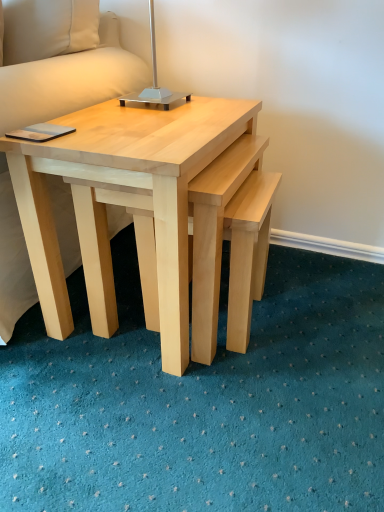
Question: Relative to white fabric pillow at upper left, is metallic silver table lamp at upper center in front or behind?

Choices:
 (A) front
 (B) behind

Answer: (A)

Question: Is metallic silver table lamp at upper center taller or shorter than white fabric pillow at upper left?

Choices:
 (A) tall
 (B) short

Answer: (A)

Question: Based on their relative distances, which object is farther from the natural wood coffee table at center?

Choices:
 (A) white fabric pillow at upper left
 (B) metallic silver table lamp at upper center

Answer: (A)

Question: Which object is positioned farthest from the natural wood coffee table at center?

Choices:
 (A) metallic silver table lamp at upper center
 (B) white fabric pillow at upper left

Answer: (B)